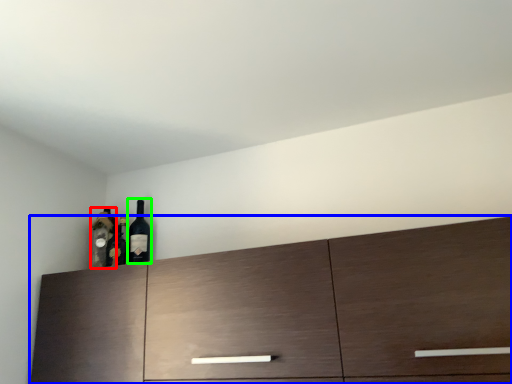
Question: Based on their relative distances, which object is farther from bottle (highlighted by a red box)? Choose from cabinetry (highlighted by a blue box) and wine bottle (highlighted by a green box).

Choices:
 (A) cabinetry
 (B) wine bottle

Answer: (A)